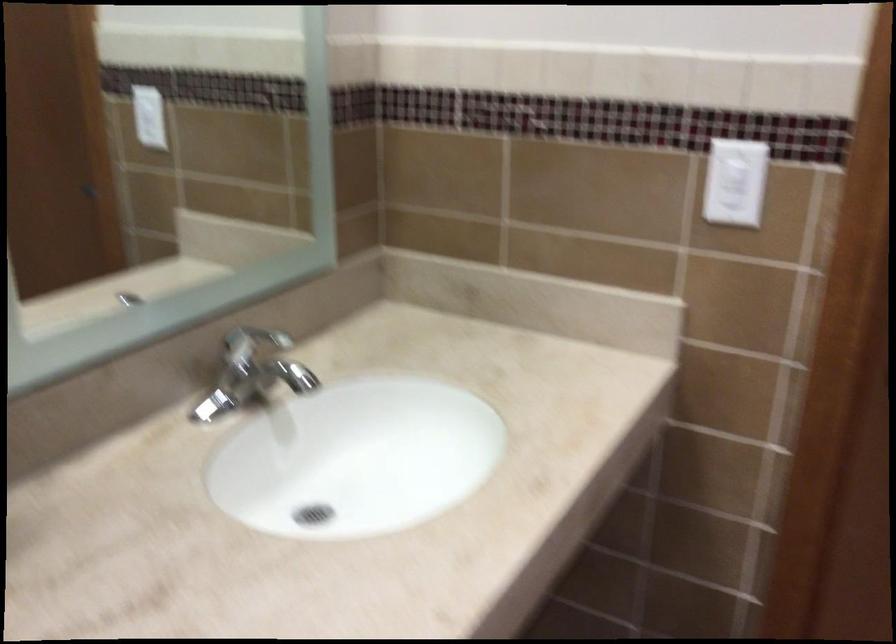
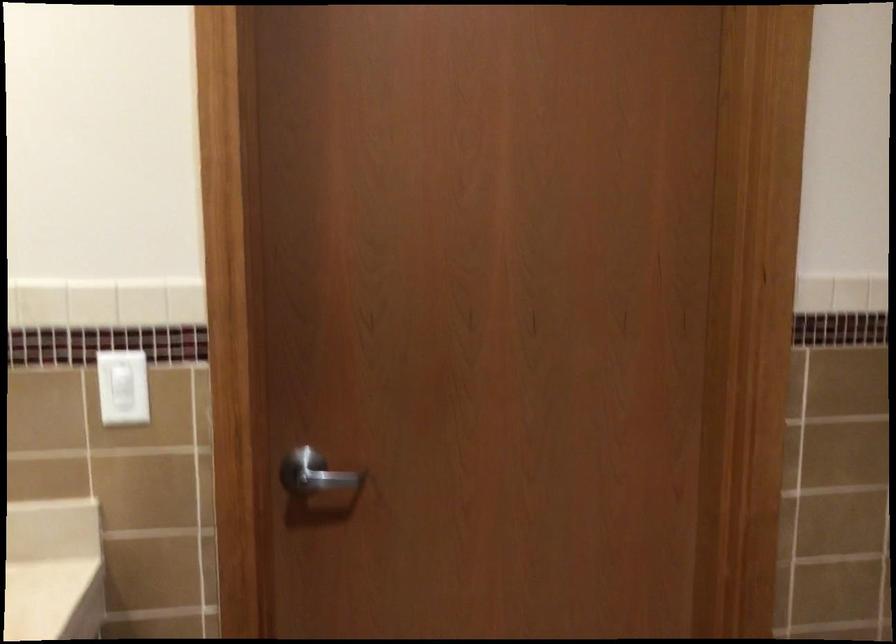
Question: The camera is either moving clockwise (left) or counter-clockwise (right) around the object. The first image is from the beginning of the video and the second image is from the end. Is the camera moving left or right when shooting the video?

Choices:
 (A) Left
 (B) Right

Answer: (A)